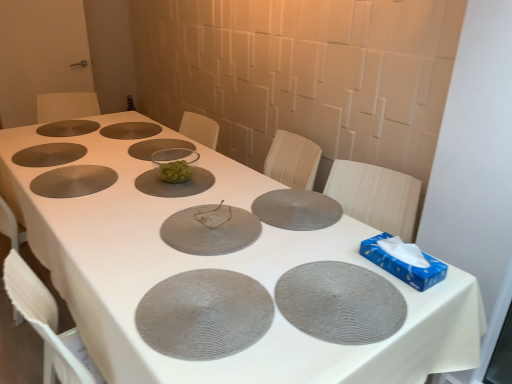
Locate an element on the screen. vacant space that is in between matte gray plate at upper left, positioned as the fourth glass plate in back-to-front order, and gray textured placemat at center, positioned as the 10th glass plate in back-to-front order is located at coordinates (92, 204).